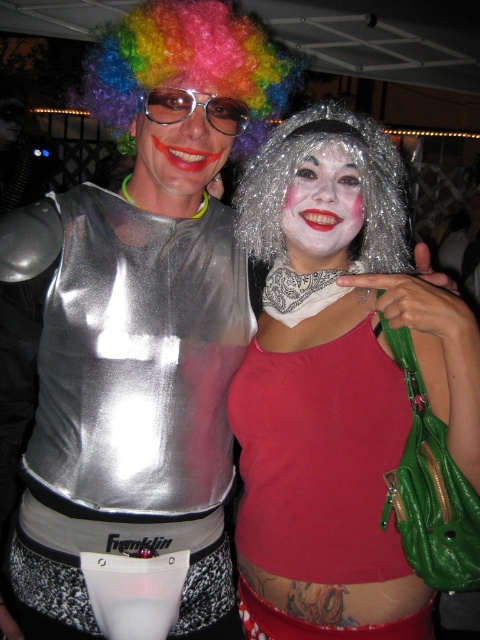
Looking at the image of two costumed individuals, you notice the white matte face at center and the shiny metallic goggles at center. Which object is positioned to the right of the other?

The white matte face at center is to the right of the shiny metallic goggles at center.

You are a photographer standing 1 meter away from the shiny metallic wig at center. Can you safely take a photo without getting too close to the people in the scene?

The shiny metallic wig at center is 1.08 meters away from the viewer, so yes, you can safely take a photo without getting too close since the distance is slightly more than 1 meter.

You are standing at the origin point in the image. Which of the two points, point (x=298, y=218) or point (x=239, y=125), is farther from you?

Point (x=298, y=218) is farther from you than point (x=239, y=125).